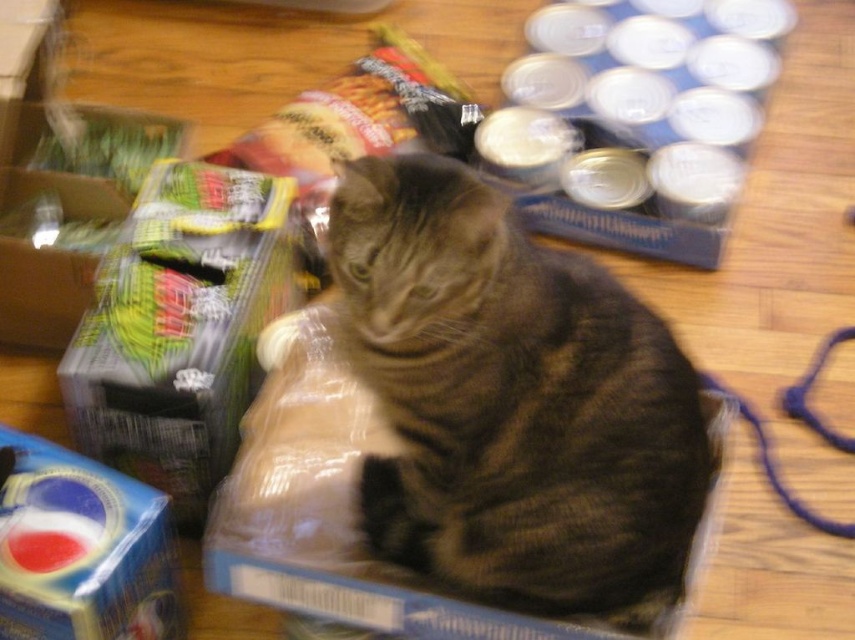
Question: Which point is closer to the camera?

Choices:
 (A) translucent plastic bag at center
 (B) blue cardboard box at lower left

Answer: (B)

Question: Where is gray tabby cat at center located in relation to translucent plastic bag at center in the image?

Choices:
 (A) left
 (B) right

Answer: (B)

Question: Is gray tabby cat at center below translucent plastic bag at center?

Choices:
 (A) no
 (B) yes

Answer: (B)

Question: Which of the following is the closest to the observer?

Choices:
 (A) gray tabby cat at center
 (B) translucent plastic bag at center

Answer: (A)

Question: Among these points, which one is farthest from the camera?

Choices:
 (A) (556, 497)
 (B) (104, 589)

Answer: (B)

Question: Can you confirm if gray tabby cat at center is positioned to the left of blue cardboard box at lower left?

Choices:
 (A) yes
 (B) no

Answer: (B)